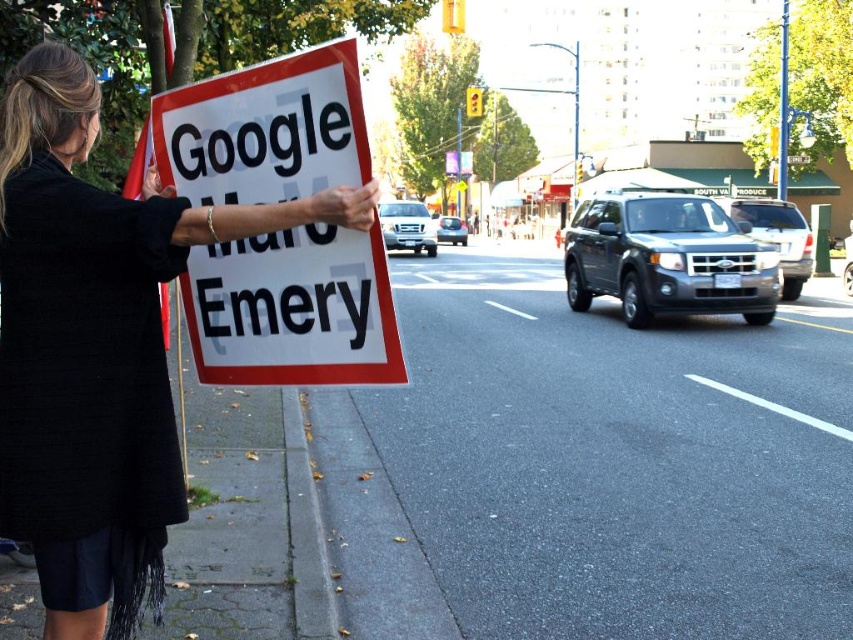
Consider the image. You are a photographer trying to capture the white paper sign at left and the black fabric dress at left in a single frame. Based on their sizes in the image, which object would appear larger in your photo?

The black fabric dress at left appears larger in the photo because it has a greater height compared to the white paper sign at left.

You are a pedestrian trying to read the text on the white paper sign at left while standing behind the black fabric dress at left. Can you see the entire sign clearly?

The black fabric dress at left is in front of the white paper sign at left, so the dress may block your view of the sign, making it difficult to see the entire sign clearly.

You are a photographer trying to capture a clear shot of the white paper sign at left and the black fabric dress at left. Based on their sizes, which object should you focus on first to ensure it fits within your camera frame?

The black fabric dress at left is larger in size than the white paper sign at left, so you should focus on capturing the black fabric dress at left first to ensure it fits within your camera frame.